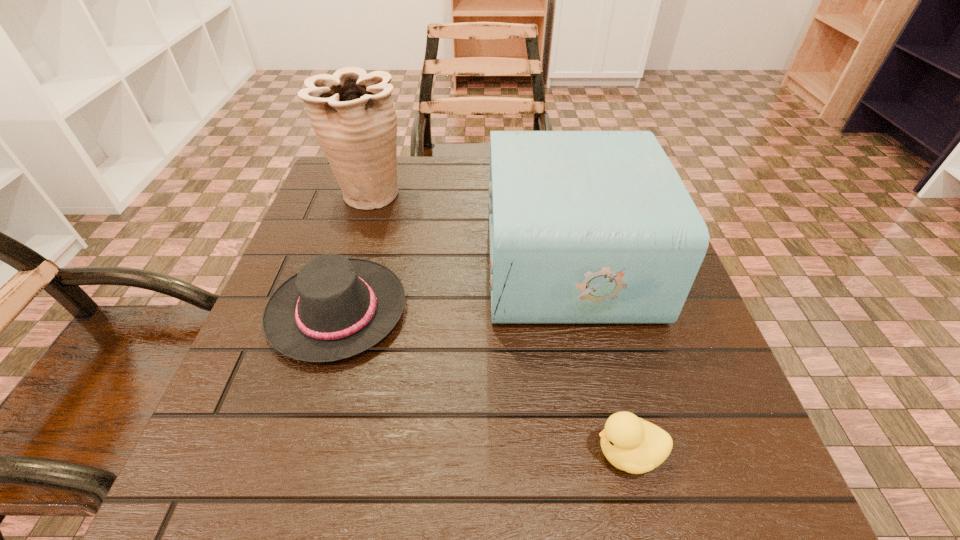
Where is `vacant area situated on the front-facing side of the nearest object`? The width and height of the screenshot is (960, 540). vacant area situated on the front-facing side of the nearest object is located at coordinates (315, 453).

The height and width of the screenshot is (540, 960). What are the coordinates of `vacant space located 0.220m on the front-facing side of the nearest object` in the screenshot? It's located at (436, 453).

At what (x,y) coordinates should I click in order to perform the action: click on urn at the far edge. Please return your answer as a coordinate pair (x, y). The image size is (960, 540). Looking at the image, I should click on (352, 113).

Find the location of a particular element. This screenshot has width=960, height=540. radio receiver present at the far edge is located at coordinates (585, 226).

Identify the location of object located in the near edge section of the desktop. The image size is (960, 540). (632, 444).

Locate an element on the screen. urn positioned at the left edge is located at coordinates (352, 113).

Where is `dress hat at the left edge`? dress hat at the left edge is located at coordinates (335, 307).

At what (x,y) coordinates should I click in order to perform the action: click on radio receiver that is at the right edge. Please return your answer as a coordinate pair (x, y). Looking at the image, I should click on click(x=585, y=226).

Locate an element on the screen. The width and height of the screenshot is (960, 540). duck that is at the right edge is located at coordinates pyautogui.click(x=632, y=444).

I want to click on object that is at the far left corner, so click(352, 113).